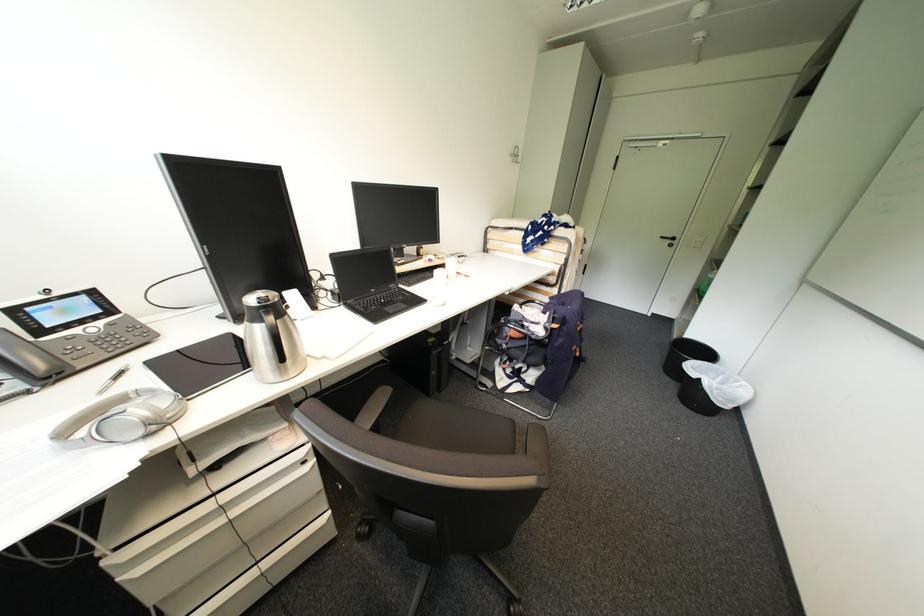
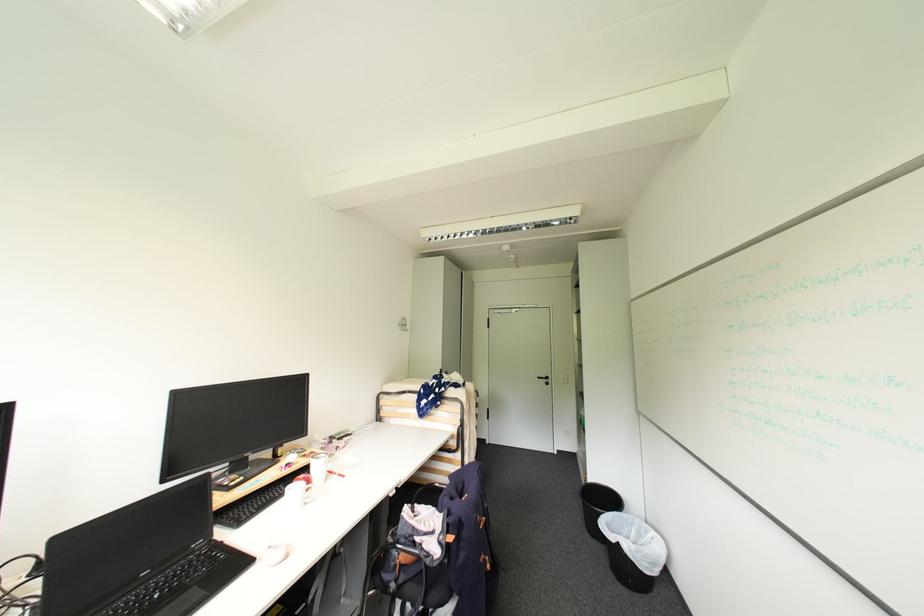
Find the pixel in the second image that matches the point at 445,259 in the first image.

(311, 456)